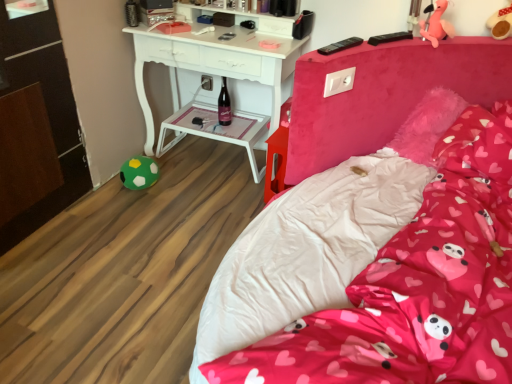
You are a GUI agent. You are given a task and a screenshot of the screen. Output one action in this format:
    pyautogui.click(x=<x>, y=<y>)
    Task: Click on the vacant area that lies in front of matte glass bottle at center
    The image size is (512, 384).
    Given the screenshot: What is the action you would take?
    pyautogui.click(x=225, y=134)